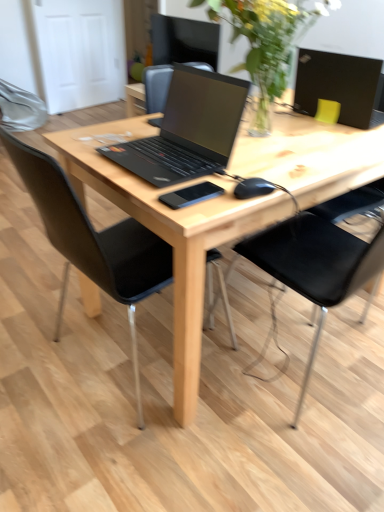
Find the location of a particular element. This screenshot has height=512, width=384. free spot above natural wood desk at center (from a real-world perspective) is located at coordinates (256, 140).